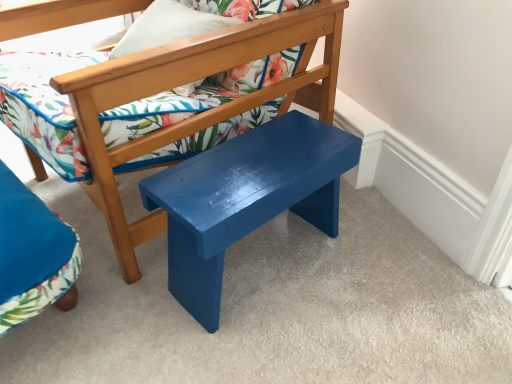
Image resolution: width=512 pixels, height=384 pixels. What are the coordinates of `vacant space situated on the left part of glossy wood stool at center` in the screenshot? It's located at (122, 294).